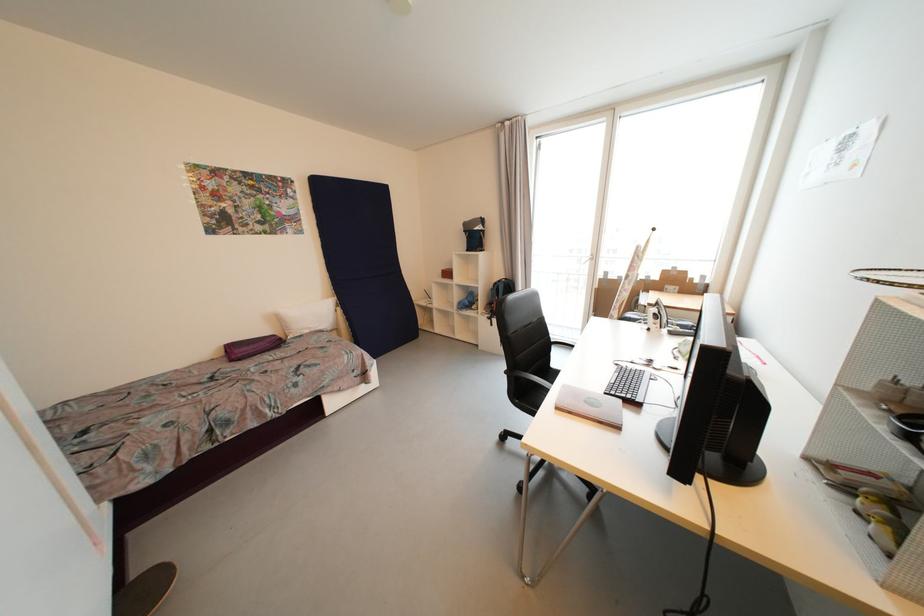
The image size is (924, 616). In order to click on chair sitting surface in this screenshot , I will do `click(535, 379)`.